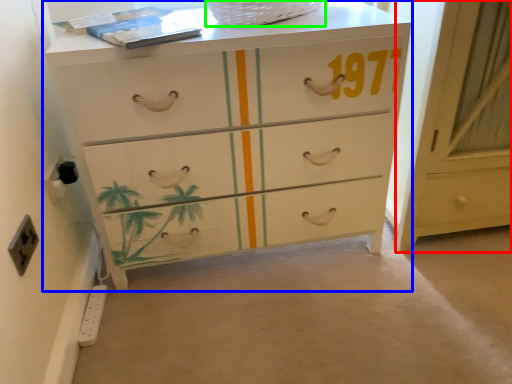
Question: Considering the real-world distances, which object is farthest from cabinetry (highlighted by a red box)? chest of drawers (highlighted by a blue box) or basket (highlighted by a green box)?

Choices:
 (A) chest of drawers
 (B) basket

Answer: (B)